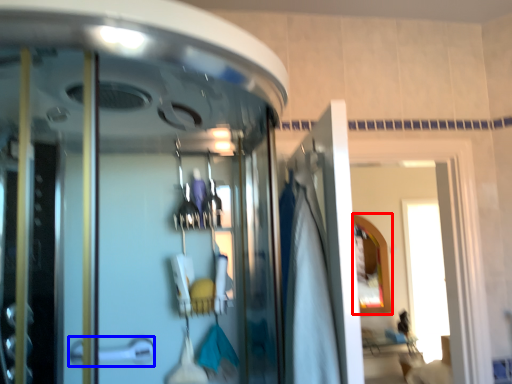
Question: Which point is closer to the camera, mirror (highlighted by a red box) or door handle (highlighted by a blue box)?

Choices:
 (A) mirror
 (B) door handle

Answer: (B)